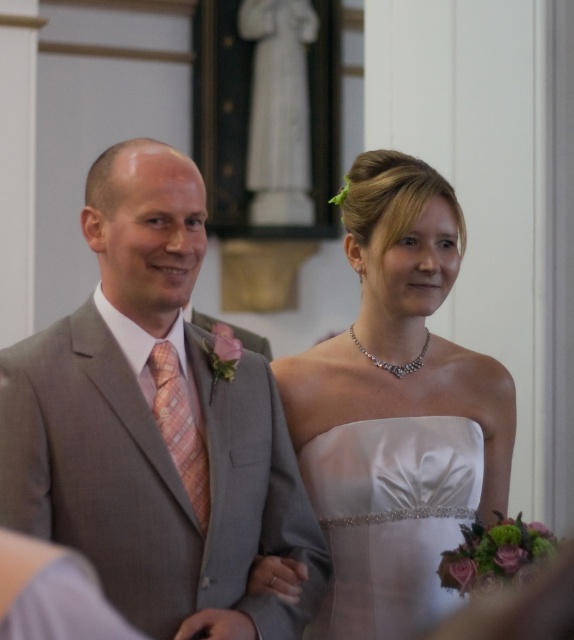
Question: Considering the relative positions of satin white dress at center and light peach plaid tie at center in the image provided, where is satin white dress at center located with respect to light peach plaid tie at center?

Choices:
 (A) right
 (B) left

Answer: (A)

Question: Which of the following is the farthest from the observer?

Choices:
 (A) (103, 189)
 (B) (195, 461)
 (C) (374, 291)
 (D) (401, 426)

Answer: (C)

Question: Which object appears farthest from the camera in this image?

Choices:
 (A) gray suit at center
 (B) satin white dress at center
 (C) white satin dress at center

Answer: (C)

Question: Does white satin dress at center appear on the right side of satin white dress at center?

Choices:
 (A) no
 (B) yes

Answer: (B)

Question: In this image, where is white satin dress at center located relative to light peach plaid tie at center?

Choices:
 (A) above
 (B) below

Answer: (A)

Question: Which of the following is the farthest from the observer?

Choices:
 (A) white satin dress at center
 (B) light peach plaid tie at center
 (C) gray suit at center
 (D) satin white dress at center

Answer: (A)